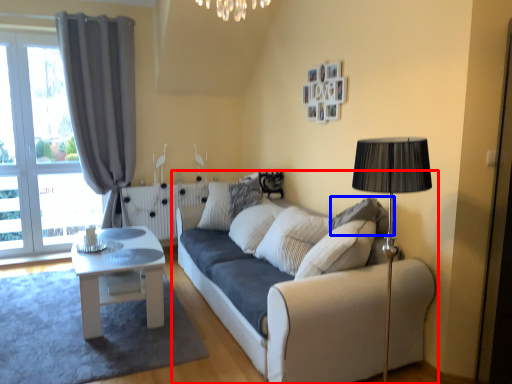
Question: Which of the following is the closest to the observer, studio couch (highlighted by a red box) or pillow (highlighted by a blue box)?

Choices:
 (A) studio couch
 (B) pillow

Answer: (A)